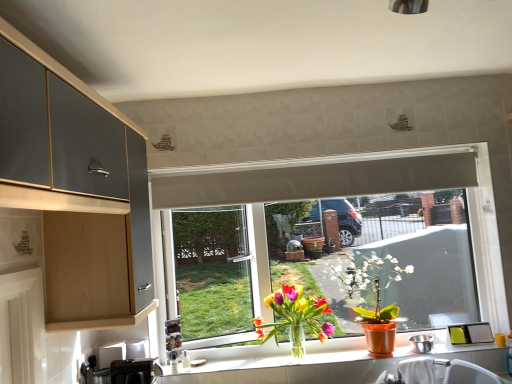
Question: Is translucent glass vase at window, the second houseplant in the right-to-left sequence, behind translucent glass vase at lower center?

Choices:
 (A) no
 (B) yes

Answer: (A)

Question: Can you confirm if translucent glass vase at window, acting as the 1th houseplant starting from the left, is thinner than translucent glass vase at lower center?

Choices:
 (A) yes
 (B) no

Answer: (B)

Question: Does translucent glass vase at window, acting as the 1th houseplant starting from the left, appear on the right side of translucent glass vase at lower center?

Choices:
 (A) no
 (B) yes

Answer: (A)

Question: Does translucent glass vase at window, the second houseplant in the right-to-left sequence, have a smaller size compared to translucent glass vase at lower center?

Choices:
 (A) yes
 (B) no

Answer: (B)

Question: Is the depth of translucent glass vase at window, acting as the 1th houseplant starting from the left, less than that of translucent glass vase at lower center?

Choices:
 (A) yes
 (B) no

Answer: (A)

Question: Is white matte window at center taller or shorter than black plastic toaster at lower left, the second appliance in the right-to-left sequence?

Choices:
 (A) tall
 (B) short

Answer: (A)

Question: Looking at the image, does white matte window at center seem bigger or smaller compared to black plastic toaster at lower left, acting as the first appliance starting from the left?

Choices:
 (A) big
 (B) small

Answer: (A)

Question: In the image, is white matte window at center on the left side or the right side of black plastic toaster at lower left, which ranks as the 2th appliance in back-to-front order?

Choices:
 (A) left
 (B) right

Answer: (B)

Question: From the image's perspective, is white matte window at center positioned above or below black plastic toaster at lower left, which ranks as the 2th appliance in back-to-front order?

Choices:
 (A) below
 (B) above

Answer: (B)

Question: Based on their positions, is translucent glass vase at lower center located to the left or right of matte orange pot at window, the second houseplant positioned from the left?

Choices:
 (A) left
 (B) right

Answer: (A)

Question: From a real-world perspective, is translucent glass vase at lower center above or below matte orange pot at window, the second houseplant positioned from the left?

Choices:
 (A) below
 (B) above

Answer: (A)

Question: Considering the positions of translucent glass vase at lower center and matte orange pot at window, the first houseplant from the right, in the image, is translucent glass vase at lower center taller or shorter than matte orange pot at window, the first houseplant from the right,?

Choices:
 (A) tall
 (B) short

Answer: (B)

Question: Does point (323, 380) appear closer or farther from the camera than point (354, 284)?

Choices:
 (A) closer
 (B) farther

Answer: (A)

Question: Based on their sizes in the image, would you say translucent glass vase at window, the second houseplant in the right-to-left sequence, is bigger or smaller than matte orange pot at window, the second houseplant positioned from the left?

Choices:
 (A) small
 (B) big

Answer: (A)

Question: From the image's perspective, relative to matte orange pot at window, the first houseplant from the right, is translucent glass vase at window, acting as the 1th houseplant starting from the left, above or below?

Choices:
 (A) above
 (B) below

Answer: (B)